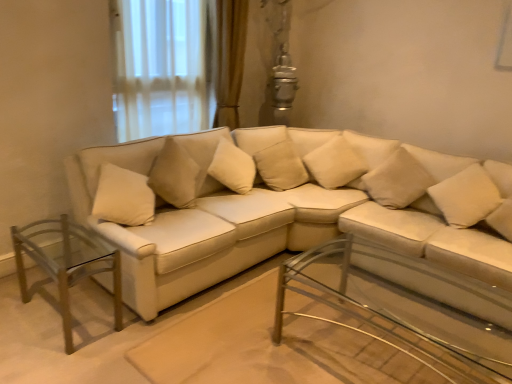
Question: Does clear glass table at left, which is counted as the second table, starting from the right, have a greater height compared to beige fabric pillow at center, the first pillow from the left?

Choices:
 (A) yes
 (B) no

Answer: (B)

Question: Is the position of clear glass table at left, which is the first table from left to right, less distant than that of beige fabric pillow at center, placed as the fourth pillow when sorted from right to left?

Choices:
 (A) yes
 (B) no

Answer: (A)

Question: Does clear glass table at left, which is counted as the second table, starting from the right, appear on the right side of beige fabric pillow at center, placed as the fourth pillow when sorted from right to left?

Choices:
 (A) no
 (B) yes

Answer: (A)

Question: Can we say clear glass table at left, which is the first table from left to right, lies outside beige fabric pillow at center, the first pillow from the left?

Choices:
 (A) no
 (B) yes

Answer: (B)

Question: From a real-world perspective, is clear glass table at left, which is the first table from left to right, located beneath beige fabric pillow at center, placed as the fourth pillow when sorted from right to left?

Choices:
 (A) no
 (B) yes

Answer: (B)

Question: Is point (300, 157) positioned closer to the camera than point (328, 162)?

Choices:
 (A) closer
 (B) farther

Answer: (B)

Question: Relative to beige fabric pillow at center, which is the third pillow in right-to-left order, is beige fabric pillow at center, placed as the fourth pillow when sorted from right to left, in front or behind?

Choices:
 (A) front
 (B) behind

Answer: (B)

Question: Is beige fabric pillow at center, the first pillow from the left, situated inside beige fabric pillow at center, which is the third pillow in right-to-left order, or outside?

Choices:
 (A) outside
 (B) inside

Answer: (A)

Question: In terms of size, does beige fabric pillow at center, placed as the fourth pillow when sorted from right to left, appear bigger or smaller than beige fabric pillow at center, which is the third pillow in right-to-left order?

Choices:
 (A) small
 (B) big

Answer: (A)

Question: From a real-world perspective, is matte white couch at center positioned above or below beige fabric pillow at center, the second pillow from the left?

Choices:
 (A) above
 (B) below

Answer: (B)

Question: Is matte white couch at center situated inside beige fabric pillow at center, which is the third pillow in right-to-left order, or outside?

Choices:
 (A) outside
 (B) inside

Answer: (A)

Question: Is matte white couch at center wider or thinner than beige fabric pillow at center, which is the third pillow in right-to-left order?

Choices:
 (A) thin
 (B) wide

Answer: (B)

Question: In the image, is matte white couch at center positioned in front of or behind beige fabric pillow at center, the second pillow from the left?

Choices:
 (A) front
 (B) behind

Answer: (A)

Question: Considering the positions of beige fabric pillow at upper right, which ranks as the 2th pillow in right-to-left order, and beige fabric pillow at center, the first pillow from the left, in the image, is beige fabric pillow at upper right, which ranks as the 2th pillow in right-to-left order, wider or thinner than beige fabric pillow at center, the first pillow from the left,?

Choices:
 (A) wide
 (B) thin

Answer: (A)

Question: From the image's perspective, is beige fabric pillow at upper right, which ranks as the 2th pillow in right-to-left order, positioned above or below beige fabric pillow at center, placed as the fourth pillow when sorted from right to left?

Choices:
 (A) above
 (B) below

Answer: (B)